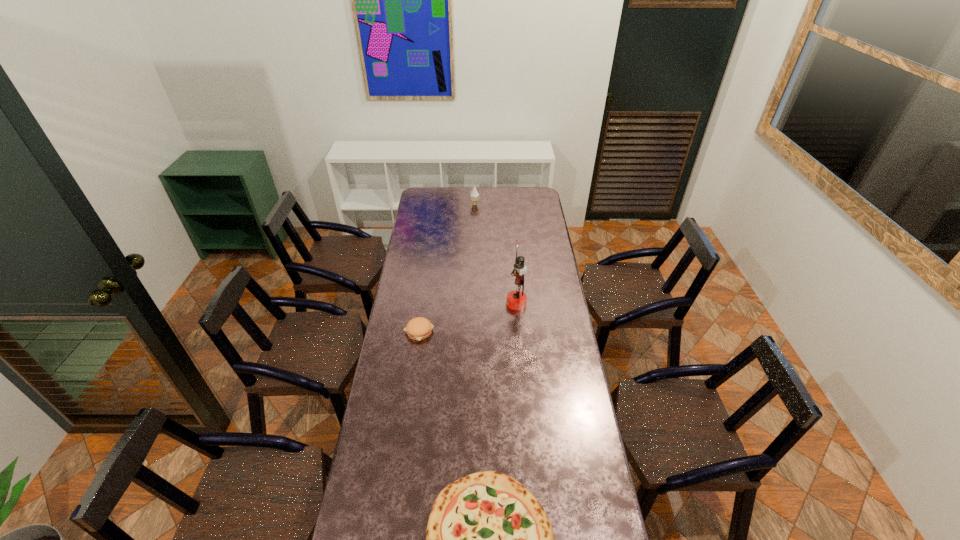
Identify the location of vacant area located 0.070m on the back of the second shortest object. This screenshot has height=540, width=960. (422, 309).

Find the location of `object located in the far edge section of the desktop`. object located in the far edge section of the desktop is located at coordinates (474, 195).

Locate an element on the screen. The image size is (960, 540). object at the left edge is located at coordinates (419, 328).

Locate an element on the screen. Image resolution: width=960 pixels, height=540 pixels. vacant space at the far edge of the desktop is located at coordinates (452, 194).

This screenshot has width=960, height=540. What are the coordinates of `vacant point at the left edge` in the screenshot? It's located at (421, 210).

Find the location of a particular element. The image size is (960, 540). vacant space at the right edge is located at coordinates (547, 267).

Identify the location of vacant space at the far left corner of the desktop. This screenshot has width=960, height=540. (439, 201).

Where is `free space between the third farthest object and the tallest object`? The height and width of the screenshot is (540, 960). free space between the third farthest object and the tallest object is located at coordinates (468, 317).

Find the location of `free space between the farthest object and the third farthest object`. free space between the farthest object and the third farthest object is located at coordinates coord(446,268).

Where is `empty location between the leftmost object and the farthest object`? This screenshot has width=960, height=540. empty location between the leftmost object and the farthest object is located at coordinates (446, 268).